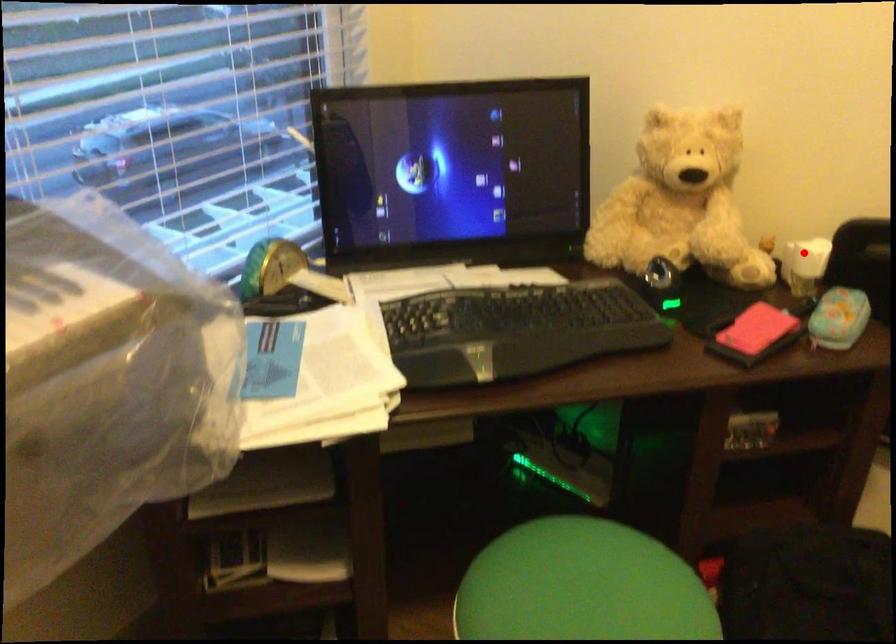
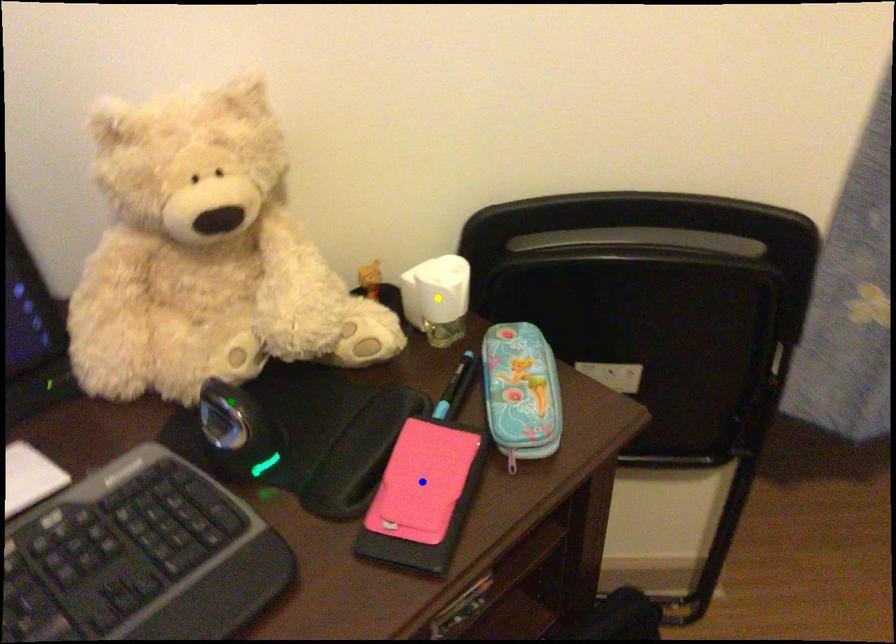
Question: I am providing you with two images of the same scene from different viewpoints. A red point is marked on the first image. You are given multiple points on the second image. In image 2, which mark is for the same physical point as the one in image 1?

Choices:
 (A) yellow point
 (B) green point
 (C) blue point

Answer: (A)